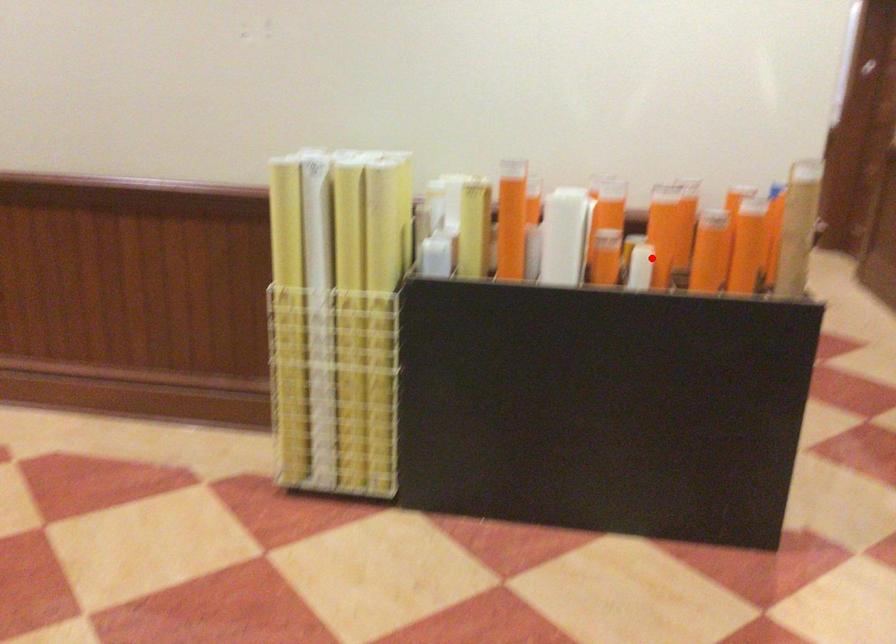
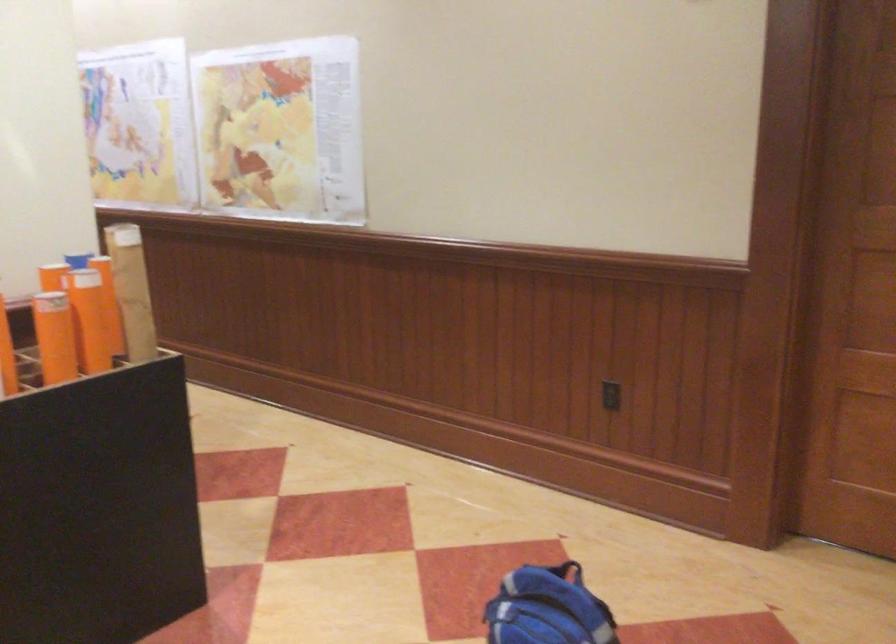
Question: A red point is marked in image1. In image2, is the corresponding 3D point closer to the camera or farther? Reply with the corresponding letter.

Choices:
 (A) The corresponding 3D point is closer.
 (B) The corresponding 3D point is farther.

Answer: (A)